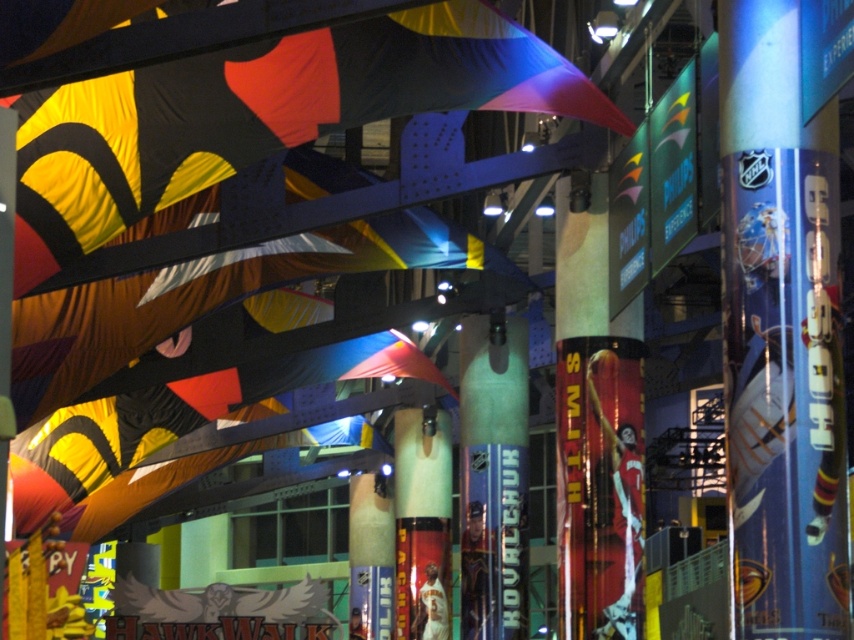
You are an event planner arranging decorations in the convention center. You need to place a new banner between the matte fabric flag at upper center and the green glossy pillar at center. Based on their positions, which object should the new banner be placed to the left of?

The matte fabric flag at upper center is positioned on the left side of green glossy pillar at center. Therefore, the new banner should be placed to the left of the green glossy pillar at center.

You are an event organizer setting up a booth in the convention center. You have a metallic blue hockey stick at center and a green glossy pillar at center. You need to place a banner that is 1.2 meters wide between them. Can the banner fit between the two objects without touching either?

The metallic blue hockey stick at center might be wider than the green glossy pillar at center. Since the banner is 1.2 meters wide, it depends on the actual width of the hockey stick and pillar. If the hockey stick is wider, there might not be enough space. If the pillar is wider, there could be sufficient space. Without exact measurements, it is uncertain if the banner will fit without touching either object.